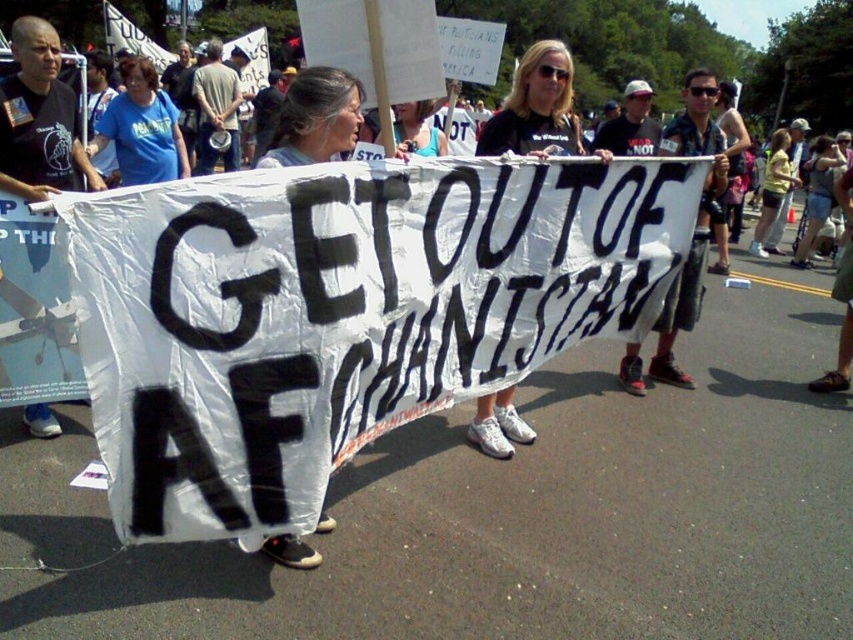
Question: Where is gray fabric shirt at center located in relation to blue t-shirt at left in the image?

Choices:
 (A) above
 (B) below

Answer: (B)

Question: Does gray fabric shirt at center appear on the right side of blue t-shirt at left?

Choices:
 (A) yes
 (B) no

Answer: (A)

Question: Is gray fabric shirt at center positioned behind blue t-shirt at left?

Choices:
 (A) yes
 (B) no

Answer: (B)

Question: Which of the following is the farthest from the observer?

Choices:
 (A) (282, 147)
 (B) (399, 116)
 (C) (144, 60)

Answer: (C)

Question: Based on their relative distances, which object is nearer to the gray fabric shirt at center?

Choices:
 (A) black t-shirt at center
 (B) matte white banner at center

Answer: (B)

Question: Which object appears farthest from the camera in this image?

Choices:
 (A) matte white banner at center
 (B) blue t-shirt at left
 (C) gray fabric shirt at center

Answer: (B)